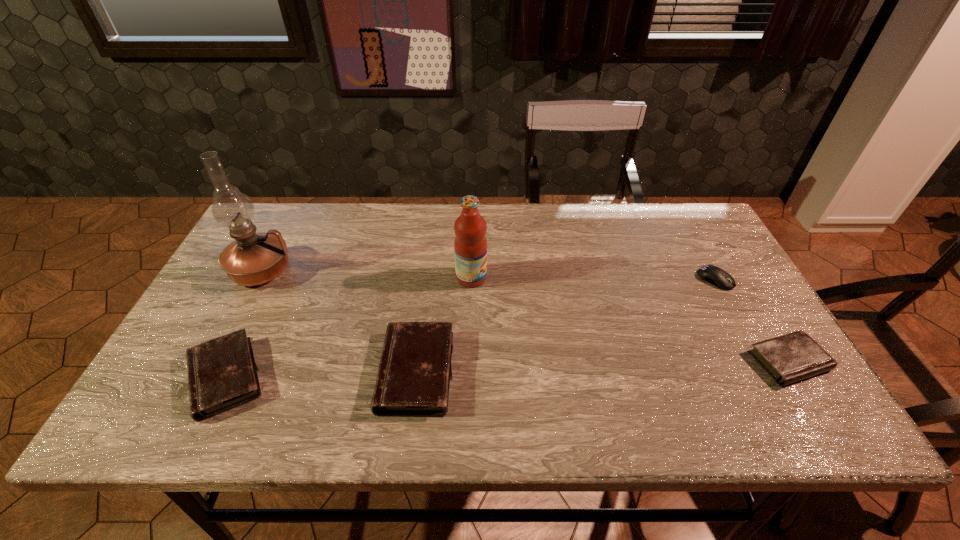
The height and width of the screenshot is (540, 960). I want to click on free point between the leftmost diary and the computer equipment, so click(470, 328).

Locate an element on the screen. The image size is (960, 540). free space between the shortest diary and the leftmost diary is located at coordinates (507, 369).

Locate an element on the screen. Image resolution: width=960 pixels, height=540 pixels. free point between the fruit juice and the second tallest diary is located at coordinates (348, 327).

Identify the location of vacant area that lies between the rightmost diary and the computer equipment. [752, 320].

Identify the location of free space between the fruit juice and the tallest object. (367, 274).

Select which object appears as the closest to the third tallest object. Please provide its 2D coordinates. Your answer should be formatted as a tuple, i.e. [(x, y)], where the tuple contains the x and y coordinates of a point satisfying the conditions above.

[(470, 244)]

You are a GUI agent. You are given a task and a screenshot of the screen. Output one action in this format:
    pyautogui.click(x=<x>, y=<y>)
    Task: Click on the object that is the closest one to the second diary from left to right
    
    Given the screenshot: What is the action you would take?
    pyautogui.click(x=470, y=244)

Choose which diary is the third nearest neighbor to the tallest object. Please provide its 2D coordinates. Your answer should be formatted as a tuple, i.e. [(x, y)], where the tuple contains the x and y coordinates of a point satisfying the conditions above.

[(795, 356)]

Locate which diary ranks third in proximity to the oil lamp. Please provide its 2D coordinates. Your answer should be formatted as a tuple, i.e. [(x, y)], where the tuple contains the x and y coordinates of a point satisfying the conditions above.

[(795, 356)]

Locate an element on the screen. The width and height of the screenshot is (960, 540). vacant region that satisfies the following two spatial constraints: 1. on the back side of the third tallest object; 2. on the left side of the fourth tallest object is located at coordinates (228, 372).